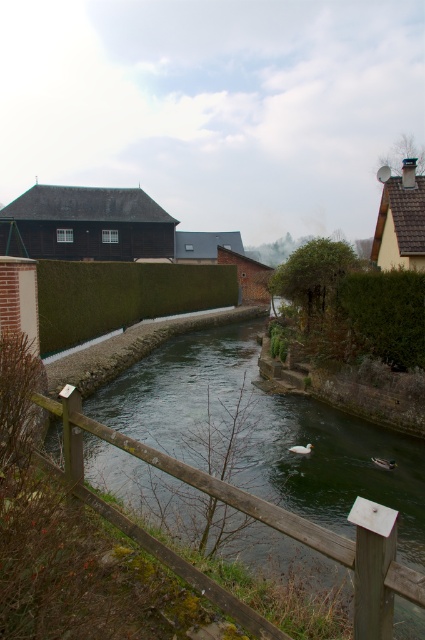
You are standing at the edge of the canal and want to cross to the other side. There is a brown wooden fence at lower center and a green leafy hedge at center right nearby. Which structure is closer to you?

The brown wooden fence at lower center is positioned under green leafy hedge at center right, so the brown wooden fence at lower center is closer to you.

You are a landscape architect designing a new pathway next to the brown wooden fence at lower center and the green leafy hedge at center right. Based on their sizes, which of the two would require more space to accommodate in the design?

The green leafy hedge at center right requires more space because it occupies more space than the brown wooden fence at lower center.